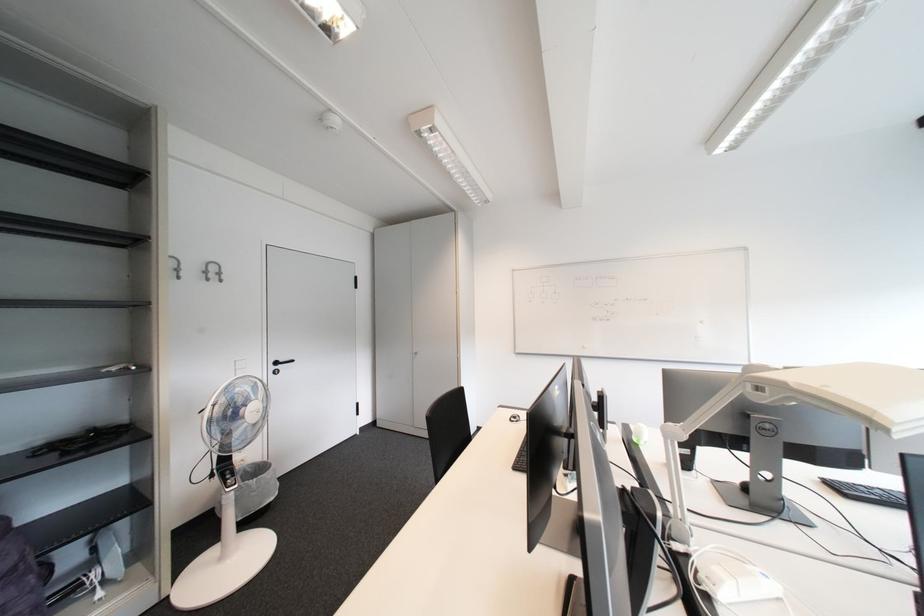
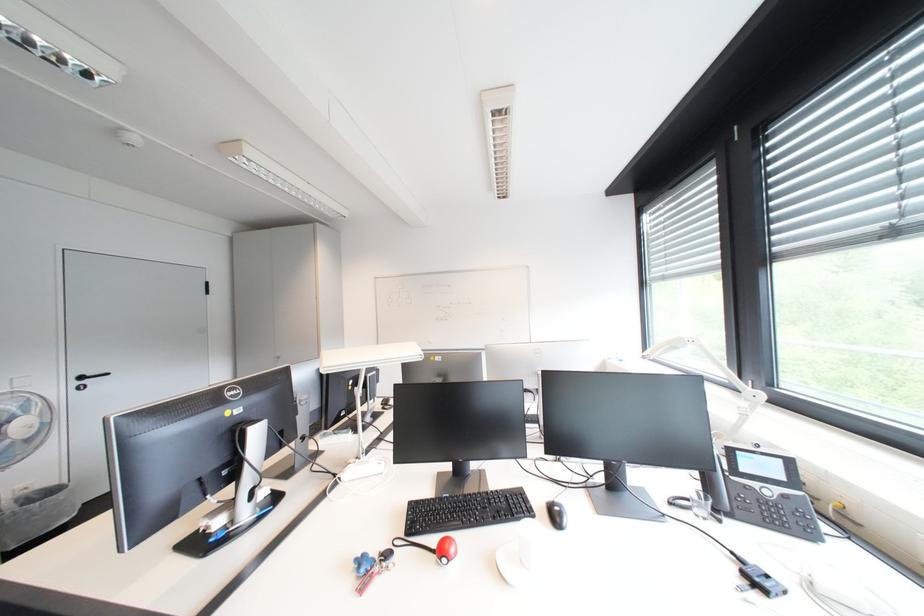
What movement of the cameraman would produce the second image?

The cameraman walked toward right, backward.